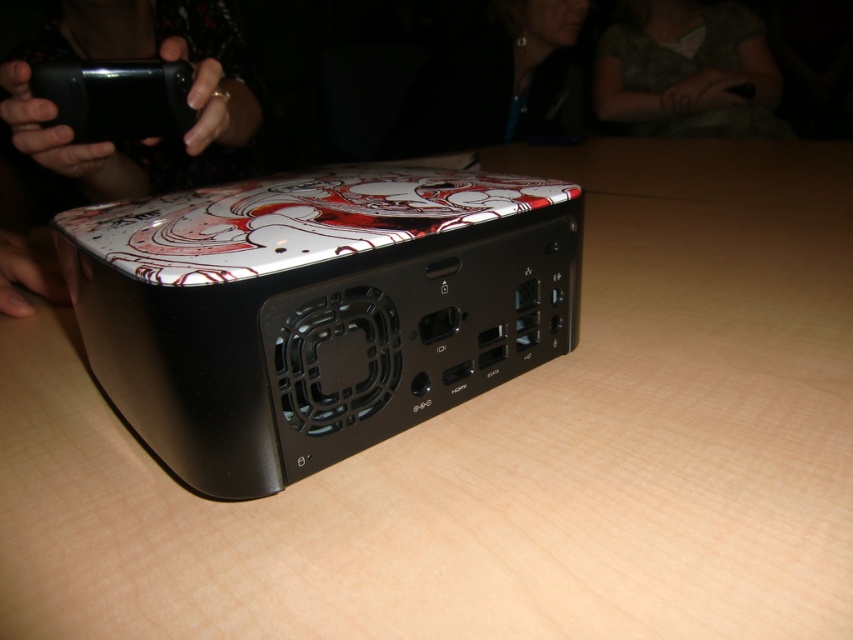
Question: Is matte black phone at upper left in front of green textured shirt at upper center?

Choices:
 (A) yes
 (B) no

Answer: (A)

Question: Is the position of glossy plastic box at center more distant than that of green textured shirt at upper center?

Choices:
 (A) no
 (B) yes

Answer: (A)

Question: Which object is the farthest from the glossy plastic box at center?

Choices:
 (A) green textured shirt at upper center
 (B) black glossy phone at upper left
 (C) matte black phone at upper left

Answer: (A)

Question: From the image, what is the correct spatial relationship of green textured shirt at upper center in relation to black glossy phone at upper left?

Choices:
 (A) left
 (B) right

Answer: (B)

Question: Which point is farther to the camera?

Choices:
 (A) (54, 90)
 (B) (714, 52)

Answer: (B)

Question: Estimate the real-world distances between objects in this image. Which object is farther from the black glossy phone at upper left?

Choices:
 (A) matte black phone at upper left
 (B) green textured shirt at upper center
 (C) glossy plastic box at center

Answer: (B)